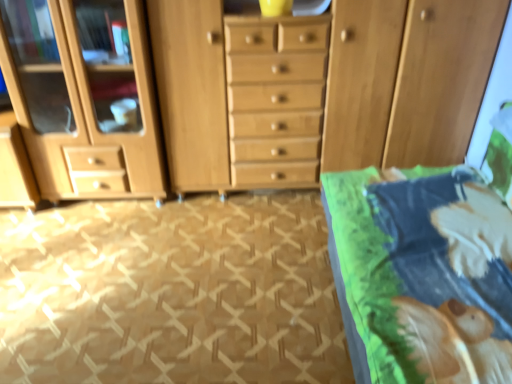
Find the location of a particular element. Image resolution: width=512 pixels, height=384 pixels. wooden dresser at center is located at coordinates (273, 91).

I want to click on green fabric bed at right, so click(x=426, y=268).

This screenshot has height=384, width=512. What do you see at coordinates (426, 268) in the screenshot?
I see `green fabric bed at right` at bounding box center [426, 268].

At what (x,y) coordinates should I click in order to perform the action: click on beige carpet at lower left. Please return your answer as a coordinate pair (x, y). The width and height of the screenshot is (512, 384). Looking at the image, I should click on (170, 292).

What is the approximate height of beige carpet at lower left?

beige carpet at lower left is 2.19 inches tall.

The image size is (512, 384). Identify the location of wooden dresser at center. (273, 91).

From the image's perspective, is beige carpet at lower left on top of wooden dresser at center?

No, from the image's perspective, beige carpet at lower left is not on top of wooden dresser at center.

Who is taller, beige carpet at lower left or wooden dresser at center?

Standing taller between the two is wooden dresser at center.

Is beige carpet at lower left in front of or behind wooden dresser at center in the image?

Clearly, beige carpet at lower left is in front of wooden dresser at center.

From the image's perspective, is green fabric bed at right over wooden dresser at center?

No, from the image's perspective, green fabric bed at right is not above wooden dresser at center.

From a real-world perspective, is green fabric bed at right located beneath wooden dresser at center?

Correct, in the physical world, green fabric bed at right is lower than wooden dresser at center.

In the image, is beige carpet at lower left on the left side or the right side of green fabric bed at right?

Based on their positions, beige carpet at lower left is located to the left of green fabric bed at right.

Measure the distance from beige carpet at lower left to green fabric bed at right.

beige carpet at lower left is 25.46 inches away from green fabric bed at right.

Is beige carpet at lower left directly adjacent to green fabric bed at right?

No.

Is beige carpet at lower left wider or thinner than green fabric bed at right?

beige carpet at lower left is wider than green fabric bed at right.

Identify the location of tile below the wooden dresser at center (from the image's perspective). (170, 292).

Considering the sizes of wooden dresser at center and beige carpet at lower left in the image, is wooden dresser at center taller or shorter than beige carpet at lower left?

In the image, wooden dresser at center appears to be taller than beige carpet at lower left.

Is wooden dresser at center positioned before beige carpet at lower left?

No, wooden dresser at center is further to the viewer.

Considering the points (357, 255) and (191, 221), which point is in front, point (357, 255) or point (191, 221)?

The point (357, 255) is closer.

Considering the positions of objects green fabric bed at right and beige carpet at lower left in the image provided, who is more to the left, green fabric bed at right or beige carpet at lower left?

Positioned to the left is beige carpet at lower left.

Considering their positions, is green fabric bed at right located in front of or behind beige carpet at lower left?

A: In the image, green fabric bed at right appears in front of beige carpet at lower left.

Could you tell me if green fabric bed at right is turned towards beige carpet at lower left?

Yes, green fabric bed at right is facing beige carpet at lower left.

Consider the image. Is wooden dresser at center turned away from green fabric bed at right?

That's not correct — wooden dresser at center is not looking away from green fabric bed at right.

Where is `bed below the wooden dresser at center (from a real-world perspective)`? Image resolution: width=512 pixels, height=384 pixels. bed below the wooden dresser at center (from a real-world perspective) is located at coordinates (426, 268).

Considering the relative sizes of wooden dresser at center and green fabric bed at right in the image provided, is wooden dresser at center smaller than green fabric bed at right?

Correct, wooden dresser at center occupies less space than green fabric bed at right.

How many degrees apart are the facing directions of wooden dresser at center and green fabric bed at right?

91.6 degrees.

You are a GUI agent. You are given a task and a screenshot of the screen. Output one action in this format:
    pyautogui.click(x=<x>, y=<y>)
    Task: Click on the dresser above the beige carpet at lower left (from the image's perspective)
    
    Given the screenshot: What is the action you would take?
    pyautogui.click(x=273, y=91)

Find the location of a particular element. This screenshot has width=512, height=384. bed below the wooden dresser at center (from the image's perspective) is located at coordinates (426, 268).

From the picture: Looking at the image, which one is located closer to beige carpet at lower left, wooden dresser at center or green fabric bed at right?

green fabric bed at right lies closer to beige carpet at lower left than the other object.

Considering their positions, is beige carpet at lower left positioned further to wooden dresser at center than green fabric bed at right?

green fabric bed at right is positioned further to the anchor wooden dresser at center.

Based on their spatial positions, is green fabric bed at right or wooden dresser at center further from beige carpet at lower left?

wooden dresser at center is further to beige carpet at lower left.

Looking at this image, when comparing their distances from green fabric bed at right, does wooden dresser at center or beige carpet at lower left seem closer?

beige carpet at lower left is positioned closer to the anchor green fabric bed at right.

Based on their spatial positions, is green fabric bed at right or beige carpet at lower left further from wooden dresser at center?

green fabric bed at right is positioned further to the anchor wooden dresser at center.

Looking at the image, which one is located further to green fabric bed at right, beige carpet at lower left or wooden dresser at center?

wooden dresser at center lies further to green fabric bed at right than the other object.

The image size is (512, 384). What are the coordinates of `dresser between beige carpet at lower left and green fabric bed at right` in the screenshot? It's located at (273, 91).